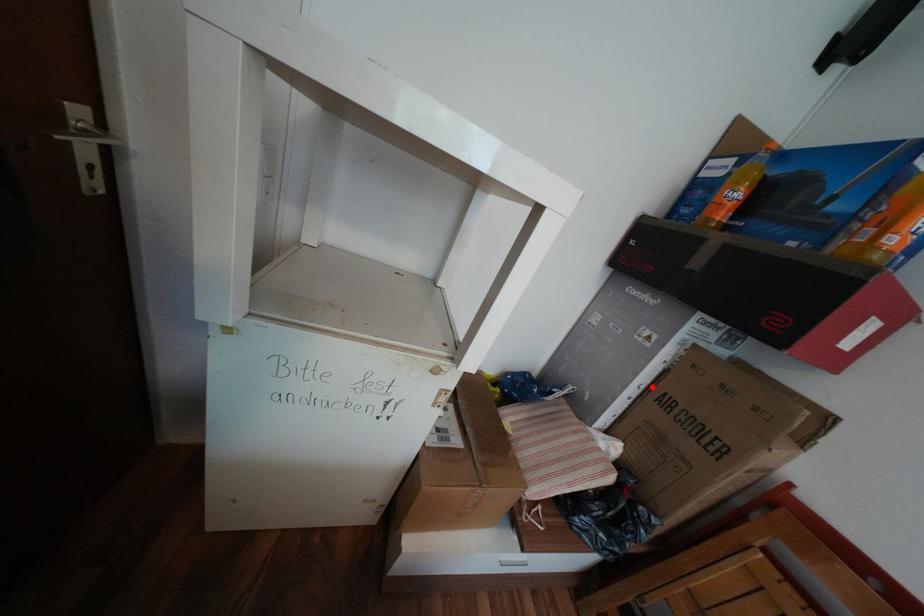
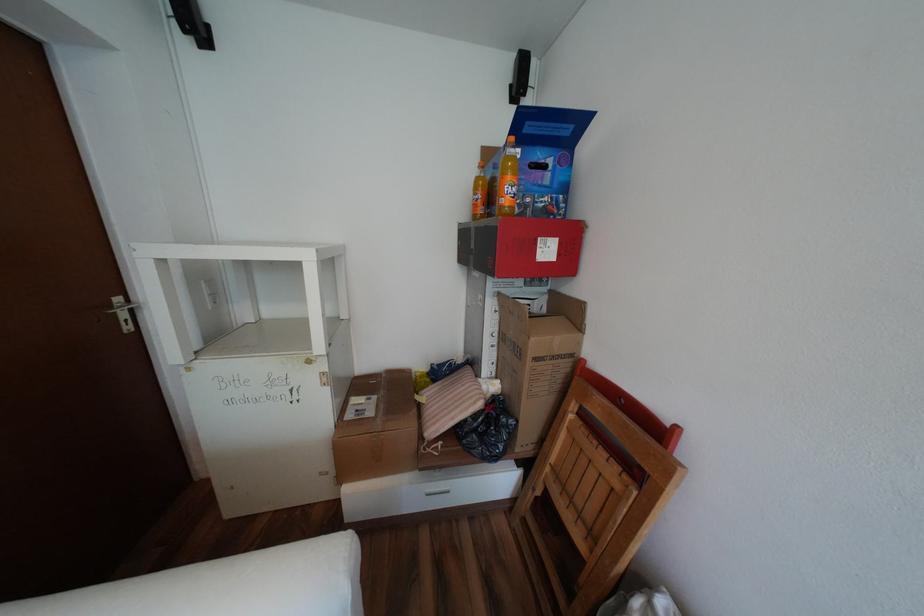
Find the pixel in the second image that matches the highlighted location in the first image.

(505, 334)